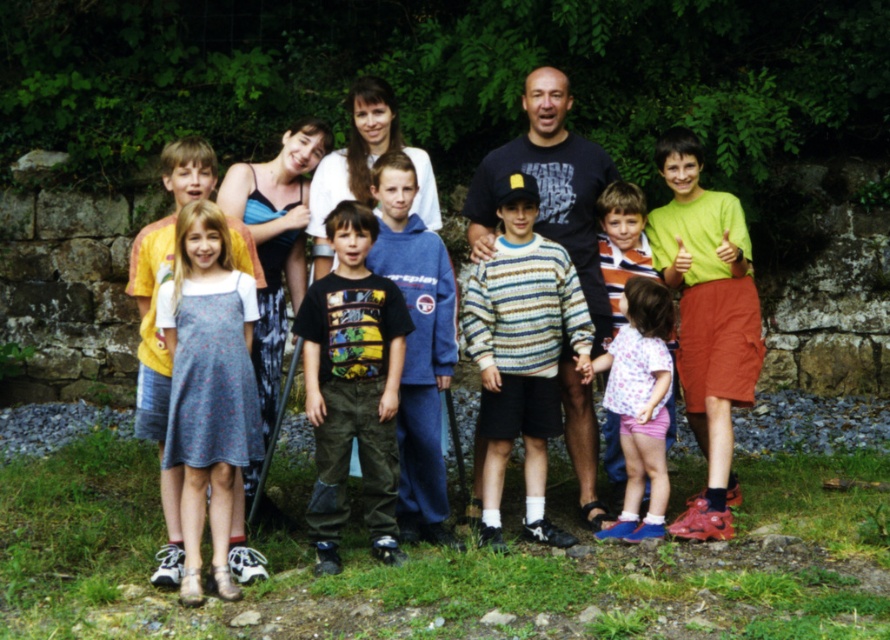
Can you confirm if floral dress at center is bigger than dress fabric at left?

Indeed, floral dress at center has a larger size compared to dress fabric at left.

Is point (427, 214) positioned after point (206, 396)?

Yes.

In order to click on floral dress at center in this screenshot , I will do `click(247, 262)`.

Between floral dress at center and printed cotton shirt at center, which one appears on the right side from the viewer's perspective?

Positioned to the right is printed cotton shirt at center.

Is point (168, 545) more distant than point (344, 282)?

No, it is in front of (344, 282).

The width and height of the screenshot is (890, 640). What are the coordinates of `floral dress at center` in the screenshot? It's located at (247, 262).

Is dress fabric at left bigger than dark blue t-shirt at center?

No, dress fabric at left is not bigger than dark blue t-shirt at center.

Can you confirm if dress fabric at left is smaller than dark blue t-shirt at center?

Yes.

You are a GUI agent. You are given a task and a screenshot of the screen. Output one action in this format:
    pyautogui.click(x=<x>, y=<y>)
    Task: Click on the dress fabric at left
    
    Given the screenshot: What is the action you would take?
    pyautogui.click(x=208, y=387)